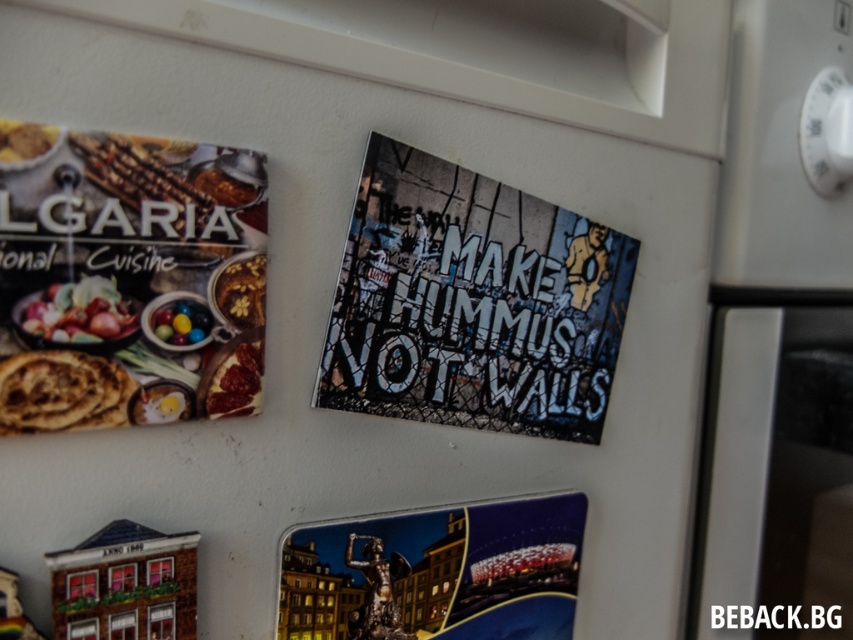
Measure the distance between shiny metallic bowl at upper left and matte brown bread at upper left.

3.58 inches

Is the position of shiny metallic bowl at upper left less distant than that of matte brown bread at upper left?

No, shiny metallic bowl at upper left is behind matte brown bread at upper left.

Who is more forward, (90, 336) or (6, 125)?

Point (6, 125) is in front.

Image resolution: width=853 pixels, height=640 pixels. I want to click on shiny metallic bowl at upper left, so click(x=80, y=310).

Does flaky pastry at upper left appear over matte brown bread at upper left?

No, flaky pastry at upper left is not above matte brown bread at upper left.

The width and height of the screenshot is (853, 640). Describe the element at coordinates (241, 291) in the screenshot. I see `flaky pastry at upper left` at that location.

Does point (218, 284) come behind point (4, 140)?

Yes, it is.

Find the location of a particular element. This screenshot has height=640, width=853. flaky pastry at upper left is located at coordinates (241, 291).

Describe the element at coordinates (80, 310) in the screenshot. I see `shiny metallic bowl at upper left` at that location.

Identify the location of shiny metallic bowl at upper left. (80, 310).